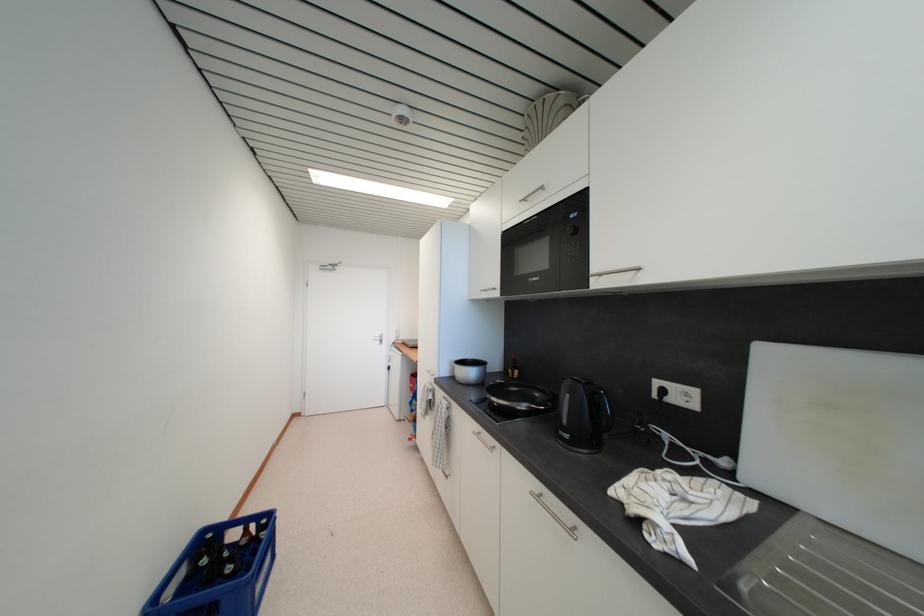
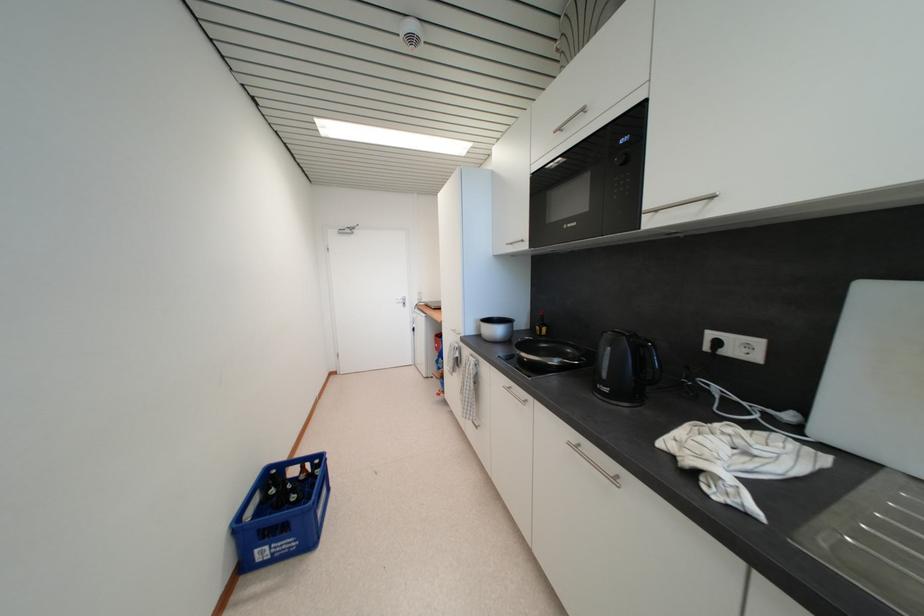
What movement of the cameraman would produce the second image?

The movement direction of the cameraman is left, forward.